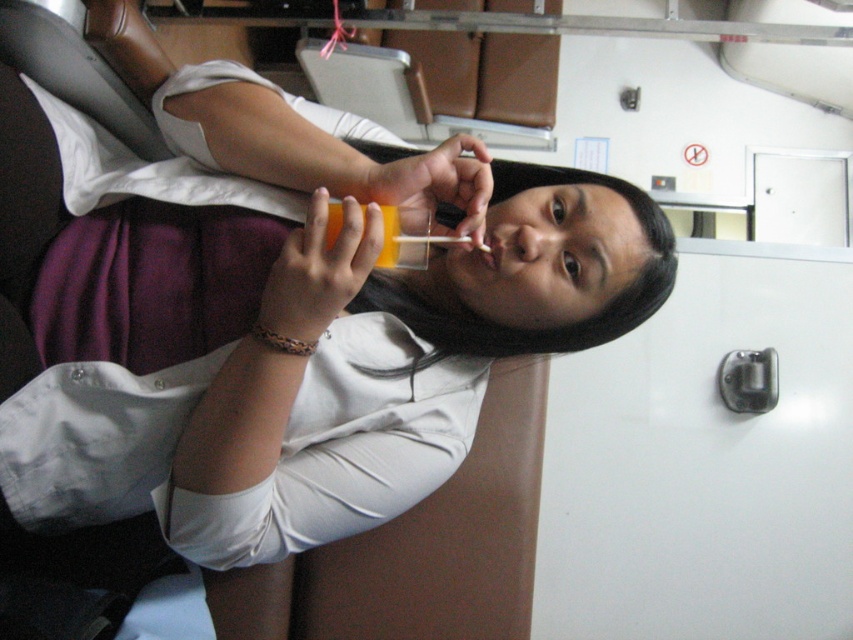
Question: Is matte orange cup at center smaller than multicolored woven bracelet at center?

Choices:
 (A) yes
 (B) no

Answer: (B)

Question: Which point is closer to the camera taking this photo?

Choices:
 (A) (335, 356)
 (B) (488, 257)

Answer: (B)

Question: Is matte orange cup at center below multicolored woven bracelet at center?

Choices:
 (A) yes
 (B) no

Answer: (A)

Question: Which object is the closest to the matte orange cup at center?

Choices:
 (A) multicolored woven bracelet at center
 (B) matte plastic mouth at center

Answer: (A)

Question: Where is matte orange cup at center located in relation to multicolored woven bracelet at center in the image?

Choices:
 (A) right
 (B) left

Answer: (A)

Question: Which point is farther from the camera taking this photo?

Choices:
 (A) (482, 262)
 (B) (277, 339)
 (C) (297, 240)

Answer: (A)